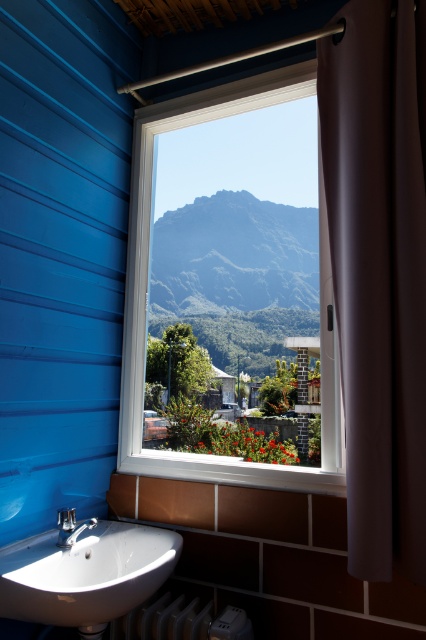
Question: Which object is farther from the camera taking this photo?

Choices:
 (A) brown fabric curtain at right
 (B) satin nickel faucet at lower left

Answer: (B)

Question: Can you confirm if white plastic window at center is wider than satin nickel faucet at lower left?

Choices:
 (A) yes
 (B) no

Answer: (A)

Question: Among these objects, which one is nearest to the camera?

Choices:
 (A) brown fabric curtain at right
 (B) white plastic radiator at lower center

Answer: (A)

Question: Where is green textured mountain at center located in relation to satin nickel faucet at lower left in the image?

Choices:
 (A) above
 (B) below

Answer: (A)

Question: Can you confirm if green textured mountain at center is wider than white glossy sink at lower left?

Choices:
 (A) no
 (B) yes

Answer: (B)

Question: Which object is positioned closest to the brown fabric curtain at right?

Choices:
 (A) white plastic radiator at lower center
 (B) green textured mountain at center

Answer: (A)